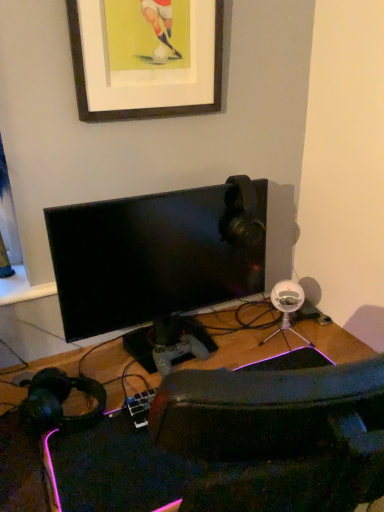
Question: Does black glossy monitor at center have a greater width compared to black matte headphones at lower left?

Choices:
 (A) no
 (B) yes

Answer: (A)

Question: From a real-world perspective, is black glossy monitor at center physically below black matte headphones at lower left?

Choices:
 (A) yes
 (B) no

Answer: (B)

Question: From the image's perspective, is black glossy monitor at center below black matte headphones at lower left?

Choices:
 (A) no
 (B) yes

Answer: (A)

Question: Does black glossy monitor at center have a larger size compared to black matte headphones at lower left?

Choices:
 (A) yes
 (B) no

Answer: (A)

Question: From the image's perspective, is black glossy monitor at center on top of black matte headphones at lower left?

Choices:
 (A) yes
 (B) no

Answer: (A)

Question: Can you confirm if black glossy monitor at center is positioned to the right of black matte headphones at lower left?

Choices:
 (A) yes
 (B) no

Answer: (A)

Question: Is wooden picture frame at upper center smaller than black matte headphones at lower left?

Choices:
 (A) yes
 (B) no

Answer: (B)

Question: Is wooden picture frame at upper center further to the viewer compared to black matte headphones at lower left?

Choices:
 (A) no
 (B) yes

Answer: (B)

Question: Is wooden picture frame at upper center in front of black matte headphones at lower left?

Choices:
 (A) no
 (B) yes

Answer: (A)

Question: From the image's perspective, does wooden picture frame at upper center appear higher than black matte headphones at lower left?

Choices:
 (A) no
 (B) yes

Answer: (B)

Question: Can you confirm if wooden picture frame at upper center is thinner than black matte headphones at lower left?

Choices:
 (A) no
 (B) yes

Answer: (B)

Question: Considering the relative sizes of wooden picture frame at upper center and black matte headphones at lower left in the image provided, is wooden picture frame at upper center taller than black matte headphones at lower left?

Choices:
 (A) no
 (B) yes

Answer: (B)

Question: Is wooden picture frame at upper center to the left of black glossy monitor at center from the viewer's perspective?

Choices:
 (A) yes
 (B) no

Answer: (A)